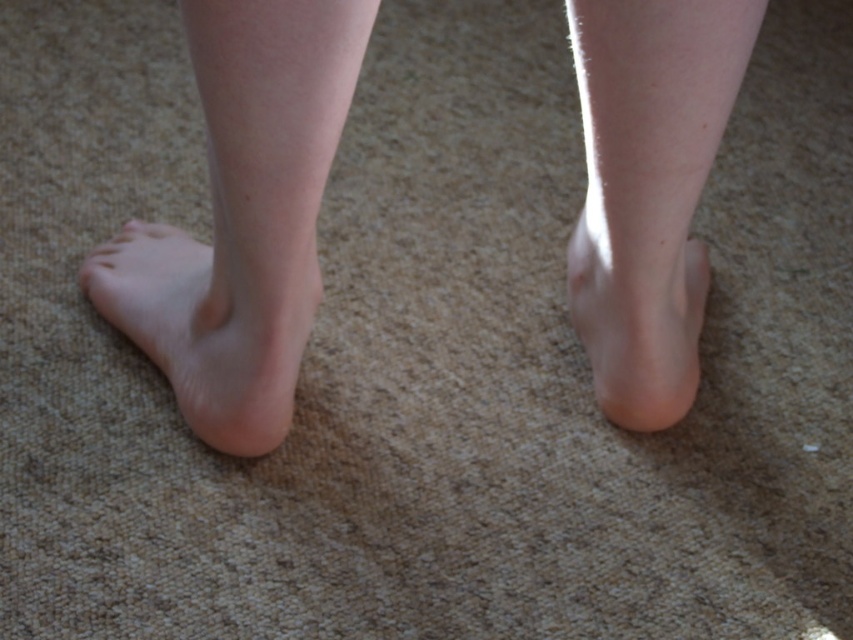
Is skinny legs at center to the right of smooth skin foot at center from the viewer's perspective?

Incorrect, skinny legs at center is not on the right side of smooth skin foot at center.

Between skinny legs at center and smooth skin foot at center, which one appears on the right side from the viewer's perspective?

Positioned to the right is smooth skin foot at center.

Is point (138, 273) farther from viewer compared to point (653, 305)?

Yes, point (138, 273) is farther from viewer.

I want to click on skinny legs at center, so click(242, 216).

Who is taller, skinny legs at center or smooth skin leg at center?

skinny legs at center

Can you confirm if skinny legs at center is positioned above smooth skin leg at center?

No.

Is point (258, 168) farther from viewer compared to point (653, 192)?

No, (258, 168) is closer to viewer.

The width and height of the screenshot is (853, 640). What are the coordinates of `skinny legs at center` in the screenshot? It's located at (242, 216).

Who is taller, skinny legs at center or smooth skin leg at left?

smooth skin leg at left

Which is more to the right, skinny legs at center or smooth skin leg at left?

Positioned to the right is skinny legs at center.

Is point (572, 317) positioned behind point (282, 436)?

Yes.

This screenshot has width=853, height=640. I want to click on skinny legs at center, so click(x=242, y=216).